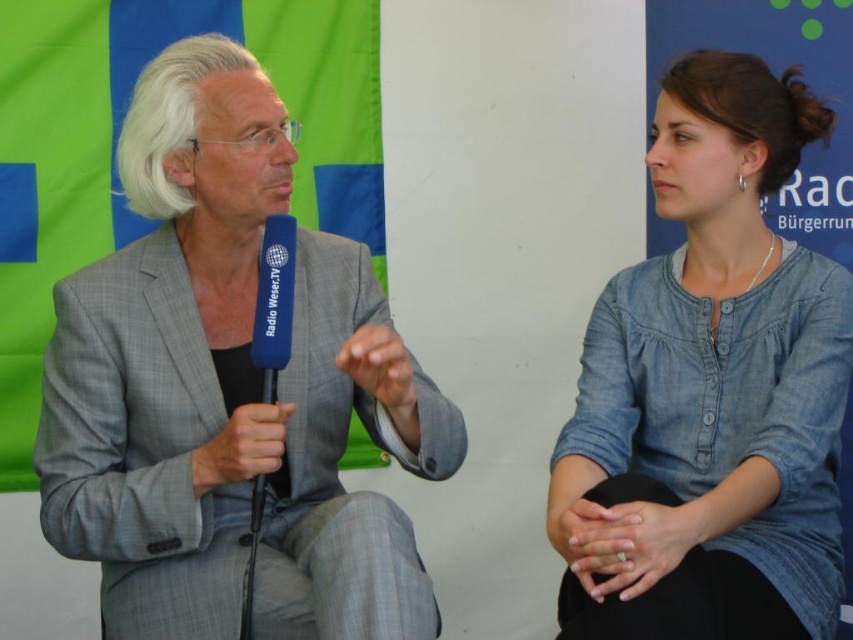
You are a fashion designer analyzing the image. You need to determine the location of the gray textured suit at left. Which coordinate point from the list below corresponds to its position? The options are point A at [229,390] or point B at 0.350, 0.450.

The gray textured suit at left is represented by point A at [229,390].

You are a photographer positioned at the camera. You want to focus on the point that is closer to you. Which point should you choose between point (x=225, y=564) and point (x=294, y=248)?

Point (x=225, y=564) is closer to the camera than point (x=294, y=248), so you should choose point (x=225, y=564).